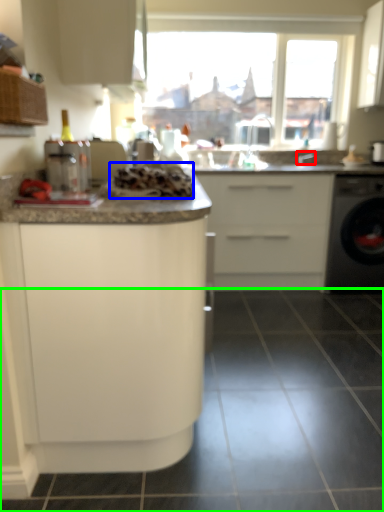
Question: Estimate the real-world distances between objects in this image. Which object is farther from faucet (highlighted by a red box), food (highlighted by a blue box) or tile (highlighted by a green box)?

Choices:
 (A) food
 (B) tile

Answer: (B)